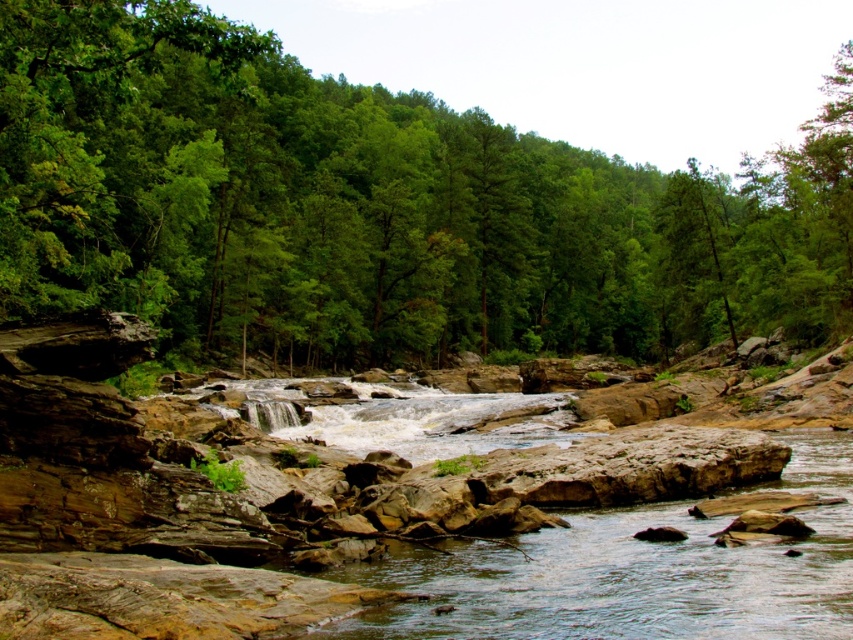
You are a hiker standing at the edge of the brown rocky river at center and want to reach the green leafy tree at upper center. Which direction should you move to get closer to the tree?

The green leafy tree at upper center is located above the brown rocky river at center, so you should move in an upward direction to reach it.

You are a hiker trying to cross the brown rocky river at center. From your vantage point, you notice the green leafy tree at upper center. Which object would you say is bigger in size?

The green leafy tree at upper center is larger in size than the brown rocky river at center.